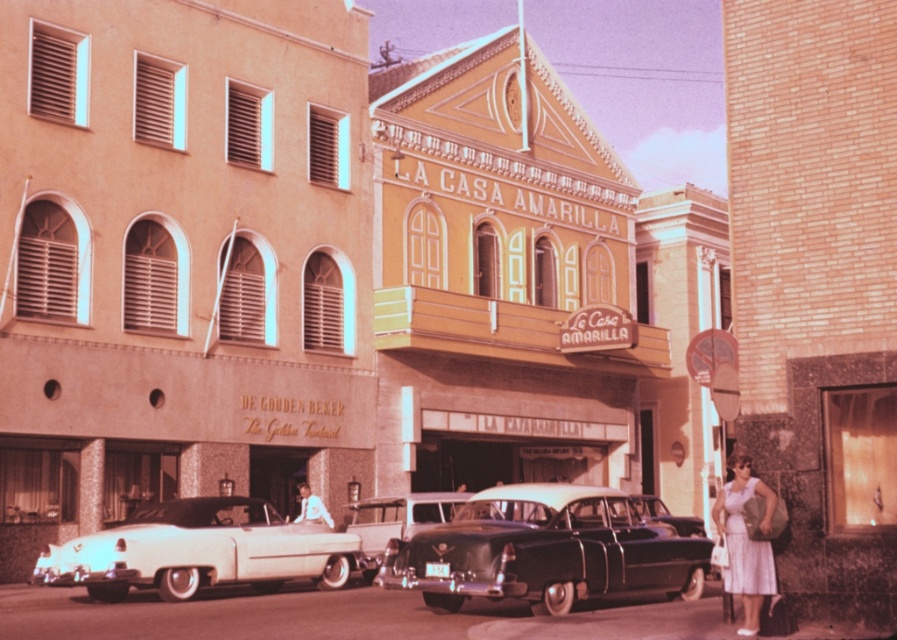
Question: Estimate the real-world distances between objects in this image. Which object is farther from the light blue shirt at center?

Choices:
 (A) white satin dress at lower right
 (B) shiny silver sedan at center
 (C) white glossy convertible at center

Answer: (A)

Question: Does white satin dress at lower right have a greater width compared to shiny black sedan at center?

Choices:
 (A) yes
 (B) no

Answer: (B)

Question: Can you confirm if white satin dress at lower right is thinner than shiny black sedan at center?

Choices:
 (A) yes
 (B) no

Answer: (A)

Question: Which object is the farthest from the light blue shirt at center?

Choices:
 (A) white satin dress at lower right
 (B) shiny black car at center
 (C) shiny black sedan at center
 (D) shiny silver sedan at center

Answer: (A)

Question: Considering the real-world distances, which object is closest to the white satin dress at lower right?

Choices:
 (A) white glossy convertible at center
 (B) shiny silver sedan at center

Answer: (B)

Question: Does white glossy convertible at center appear on the right side of shiny black sedan at center?

Choices:
 (A) yes
 (B) no

Answer: (B)